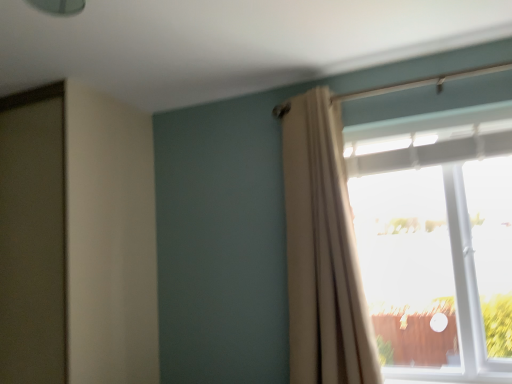
Question: Is white sheer curtain at upper right wider than transparent glass window at upper right?

Choices:
 (A) yes
 (B) no

Answer: (B)

Question: Could transparent glass window at upper right be considered to be inside white sheer curtain at upper right?

Choices:
 (A) yes
 (B) no

Answer: (B)

Question: Considering the relative positions of white sheer curtain at upper right and transparent glass window at upper right in the image provided, is white sheer curtain at upper right behind transparent glass window at upper right?

Choices:
 (A) yes
 (B) no

Answer: (B)

Question: Does white sheer curtain at upper right come in front of transparent glass window at upper right?

Choices:
 (A) no
 (B) yes

Answer: (B)

Question: Is white sheer curtain at upper right oriented away from transparent glass window at upper right?

Choices:
 (A) no
 (B) yes

Answer: (A)

Question: Considering the relative sizes of white sheer curtain at upper right and transparent glass window at upper right in the image provided, is white sheer curtain at upper right bigger than transparent glass window at upper right?

Choices:
 (A) no
 (B) yes

Answer: (A)

Question: Is transparent glass window at upper right behind white sheer curtain at upper right?

Choices:
 (A) yes
 (B) no

Answer: (A)

Question: Is the position of transparent glass window at upper right less distant than that of white sheer curtain at upper right?

Choices:
 (A) no
 (B) yes

Answer: (A)

Question: From the image's perspective, would you say transparent glass window at upper right is shown under white sheer curtain at upper right?

Choices:
 (A) no
 (B) yes

Answer: (B)

Question: From a real-world perspective, is transparent glass window at upper right beneath white sheer curtain at upper right?

Choices:
 (A) no
 (B) yes

Answer: (B)

Question: Considering the relative sizes of transparent glass window at upper right and white sheer curtain at upper right in the image provided, is transparent glass window at upper right smaller than white sheer curtain at upper right?

Choices:
 (A) yes
 (B) no

Answer: (B)

Question: Is transparent glass window at upper right looking in the opposite direction of white sheer curtain at upper right?

Choices:
 (A) no
 (B) yes

Answer: (A)

Question: Is white sheer curtain at upper right inside the boundaries of transparent glass window at upper right, or outside?

Choices:
 (A) outside
 (B) inside

Answer: (A)